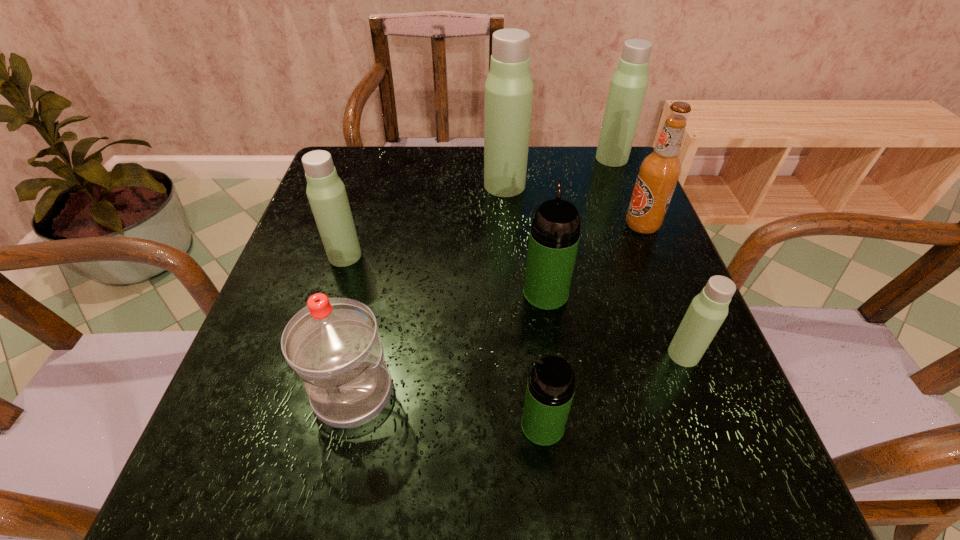
This screenshot has height=540, width=960. I want to click on free space located from the spout of the bigger green thermos bottle, so click(541, 260).

This screenshot has height=540, width=960. Find the location of `vacant position located from the spout of the bigger green thermos bottle`. vacant position located from the spout of the bigger green thermos bottle is located at coordinates (530, 178).

Locate an element on the screen. free space located 0.100m on the right of the third biggest light thermos bottle is located at coordinates (408, 255).

At what (x,y) coordinates should I click in order to perform the action: click on free location located 0.090m on the handle side of the white water bottle. Please return your answer as a coordinate pair (x, y). The width and height of the screenshot is (960, 540). Looking at the image, I should click on (331, 493).

Where is `blank space located 0.250m on the left of the smallest light thermos bottle`? This screenshot has width=960, height=540. blank space located 0.250m on the left of the smallest light thermos bottle is located at coordinates (526, 354).

Locate an element on the screen. vacant space situated 0.370m from the spout of the nearer green thermos bottle is located at coordinates (282, 425).

This screenshot has height=540, width=960. I want to click on free space located from the spout of the nearer green thermos bottle, so click(398, 425).

Identify the location of free region located 0.060m from the spout of the nearer green thermos bottle. This screenshot has height=540, width=960. 482,425.

You are a GUI agent. You are given a task and a screenshot of the screen. Output one action in this format:
    pyautogui.click(x=<x>, y=<y>)
    Task: Click on the thermos bottle situated at the left edge
    
    Given the screenshot: What is the action you would take?
    pyautogui.click(x=326, y=193)

This screenshot has height=540, width=960. Identify the location of water bottle that is at the left edge. (332, 344).